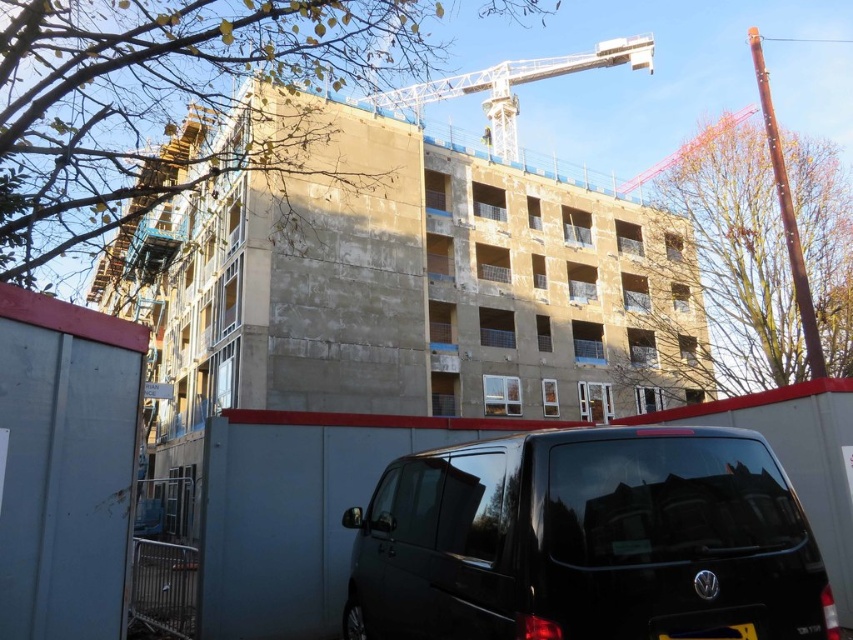
Can you confirm if black matte van at lower center is thinner than white metallic crane at upper center?

Correct, black matte van at lower center's width is less than white metallic crane at upper center's.

Locate an element on the screen. This screenshot has height=640, width=853. black matte van at lower center is located at coordinates (585, 540).

From the picture: Who is more distant from viewer, (x=492, y=92) or (x=741, y=636)?

Positioned behind is point (x=492, y=92).

Who is more forward, (555,61) or (746,621)?

Point (746,621)

Identify the location of white metallic crane at upper center. Image resolution: width=853 pixels, height=640 pixels. (514, 84).

Who is positioned more to the left, black matte van at lower center or yellow plastic license plate at lower center?

black matte van at lower center is more to the left.

Is point (669, 557) positioned in front of point (747, 632)?

No.

Between point (479, 525) and point (732, 632), which one is positioned behind?

Positioned behind is point (479, 525).

The width and height of the screenshot is (853, 640). Find the location of `black matte van at lower center`. black matte van at lower center is located at coordinates (585, 540).